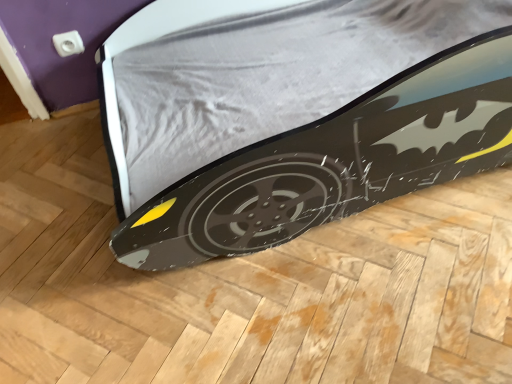
What do you see at coordinates (293, 116) in the screenshot? I see `glossy plastic skateboard at lower center` at bounding box center [293, 116].

You are a GUI agent. You are given a task and a screenshot of the screen. Output one action in this format:
    pyautogui.click(x=<x>, y=<y>)
    Task: Click on the glossy plastic skateboard at lower center
    The width and height of the screenshot is (512, 384).
    Given the screenshot: What is the action you would take?
    pyautogui.click(x=293, y=116)

What are the coordinates of `glossy plastic skateboard at lower center` in the screenshot? It's located at (293, 116).